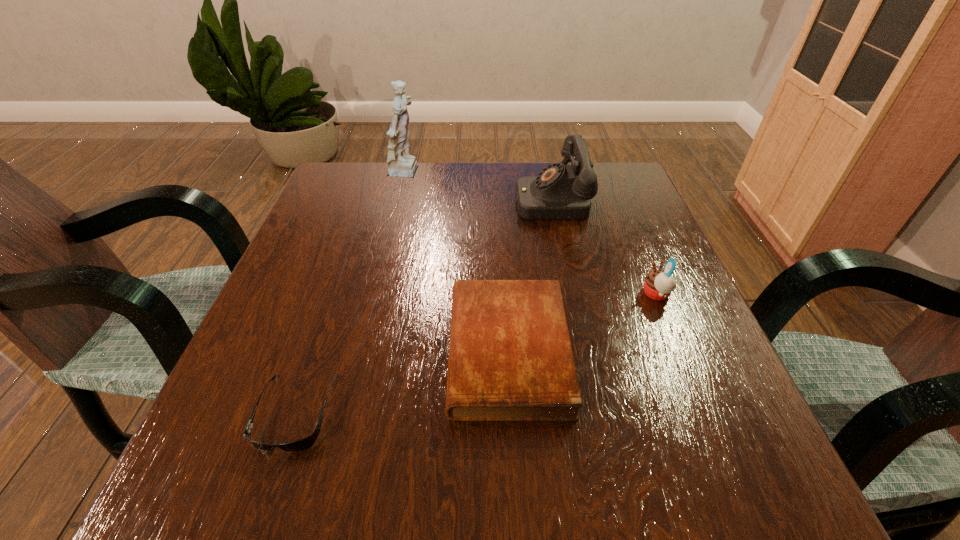
I want to click on sunglasses that is at the left edge, so click(305, 443).

The image size is (960, 540). I want to click on telephone present at the right edge, so click(x=560, y=192).

The width and height of the screenshot is (960, 540). What are the coordinates of `muffin present at the right edge` in the screenshot? It's located at pos(658,284).

Where is `object that is at the far left corner`? The image size is (960, 540). object that is at the far left corner is located at coordinates (401, 164).

Identify the location of object at the near left corner. The image size is (960, 540). (305, 443).

Locate an element on the screen. This screenshot has height=540, width=960. object that is positioned at the far right corner is located at coordinates (560, 192).

Locate an element on the screen. The height and width of the screenshot is (540, 960). free space at the far edge of the desktop is located at coordinates (543, 164).

The width and height of the screenshot is (960, 540). In the image, there is a desktop. Identify the location of free region at the near edge. (596, 500).

This screenshot has width=960, height=540. What are the coordinates of `vacant space at the left edge` in the screenshot? It's located at (353, 216).

In the image, there is a desktop. Where is `vacant space at the right edge`? vacant space at the right edge is located at coordinates (610, 276).